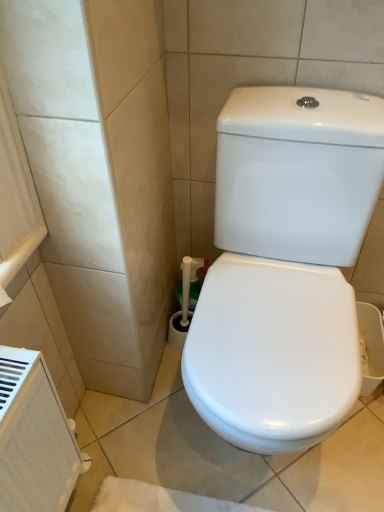
You are a GUI agent. You are given a task and a screenshot of the screen. Output one action in this format:
    pyautogui.click(x=<x>, y=<y>)
    Task: Click on the white glossy toilet at center
    This screenshot has height=512, width=384.
    Given the screenshot: What is the action you would take?
    pyautogui.click(x=284, y=266)

The height and width of the screenshot is (512, 384). Describe the element at coordinates (284, 266) in the screenshot. I see `white glossy toilet at center` at that location.

What is the approximate height of white glossy toilet at center?

white glossy toilet at center is 31.68 inches in height.

Find the location of `white glossy toilet at center`. white glossy toilet at center is located at coordinates (284, 266).